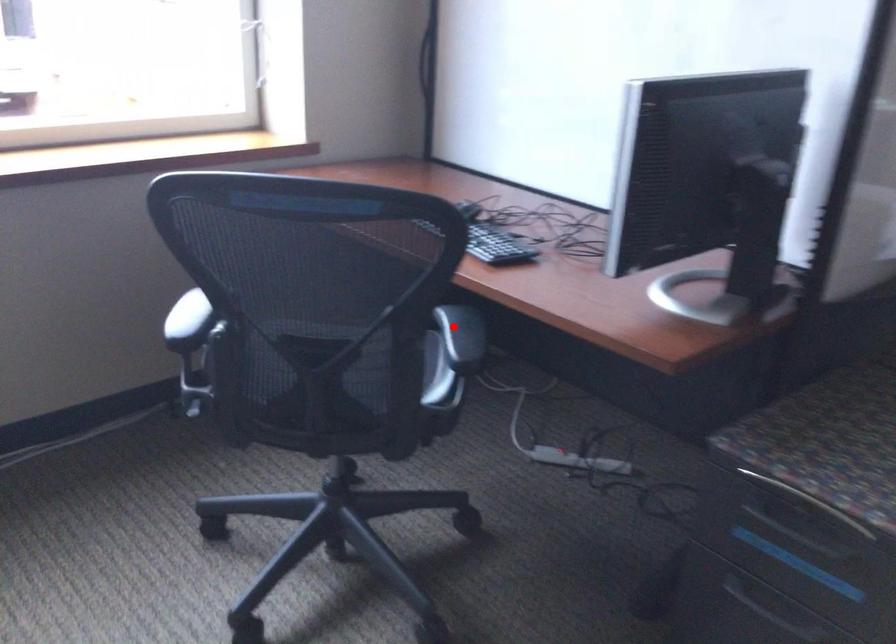
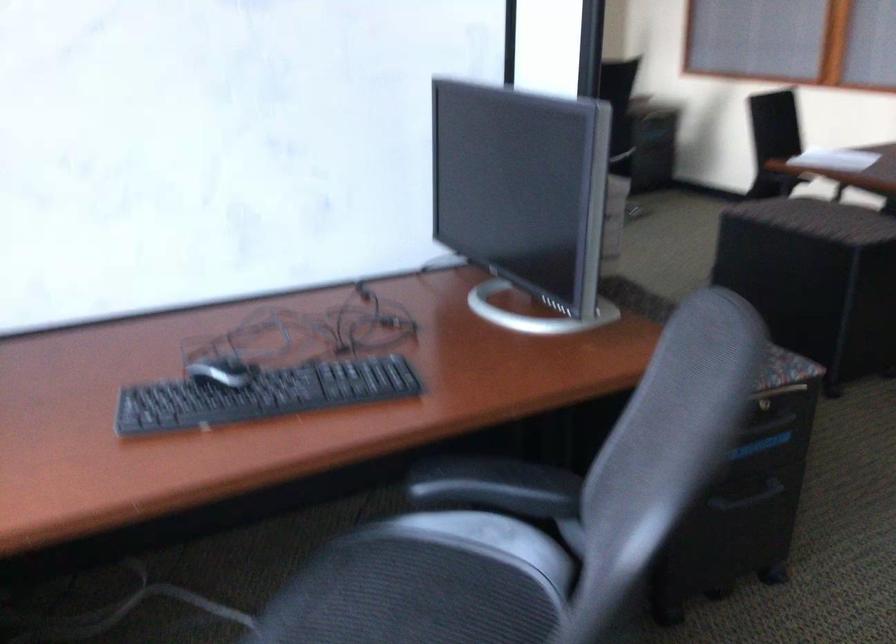
Find the pixel in the second image that matches the highlighted location in the first image.

(495, 486)